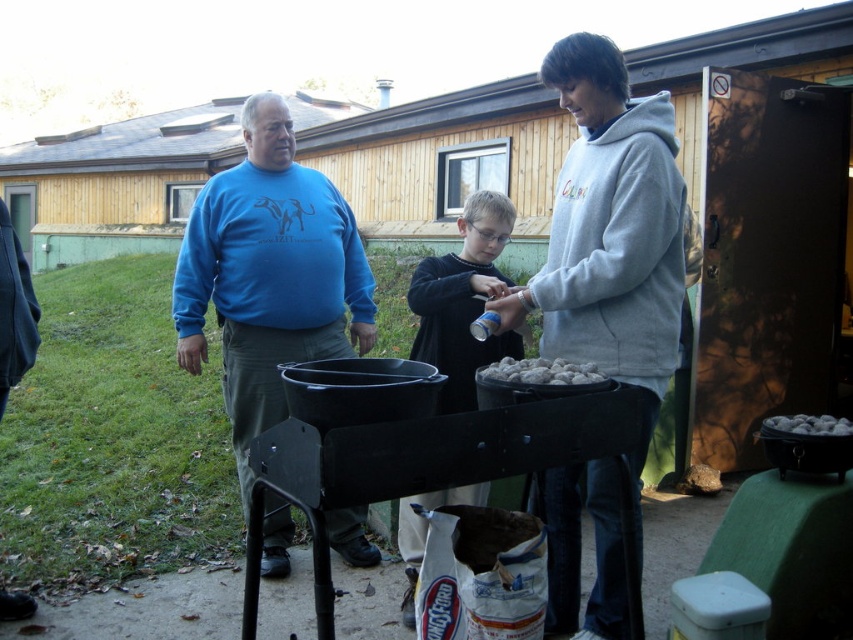
You are standing in the outdoor cooking area and want to place a small plate on the closest point between point [657,324] and point [631,113]. Which point should you choose?

Point [657,324] is closer to the viewer than point [631,113], so you should place the plate on point [657,324].

You are trying to decide which clothing item to take off first because it is getting too hot. You see the blue cotton shirt at center and the dark blue sweater at center. Which one should you remove first if you want to cool down more effectively?

The blue cotton shirt at center is wider than the dark blue sweater at center, so removing the blue cotton shirt at center first would allow more airflow and cooling.

You are a photographer trying to capture a group photo of the people at the outdoor cooking scene. You notice two clothing items worn by the individuals at the center of the image. The blue cotton shirt at center and the dark blue sweater at center. Which clothing item is taller in the photo?

The blue cotton shirt at center is taller than the dark blue sweater at center.